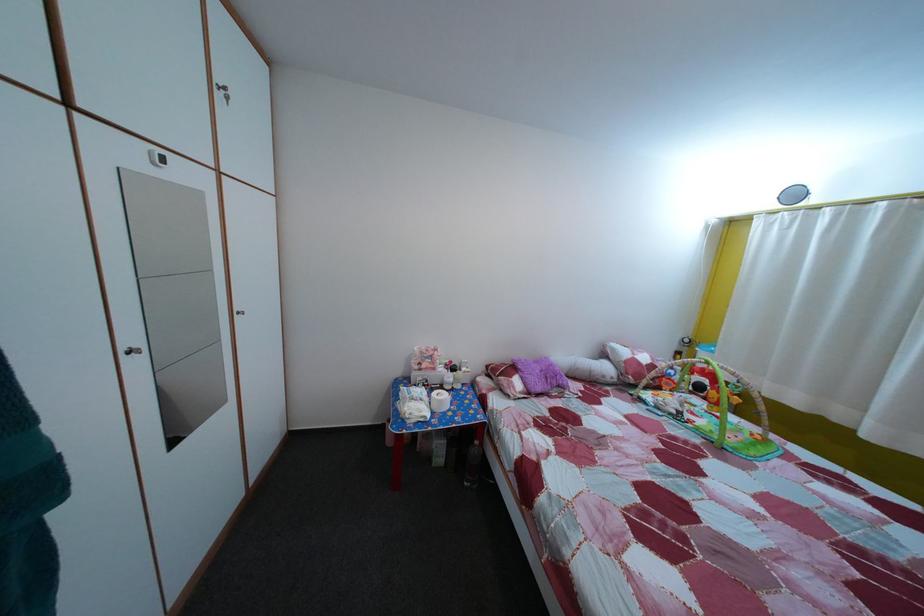
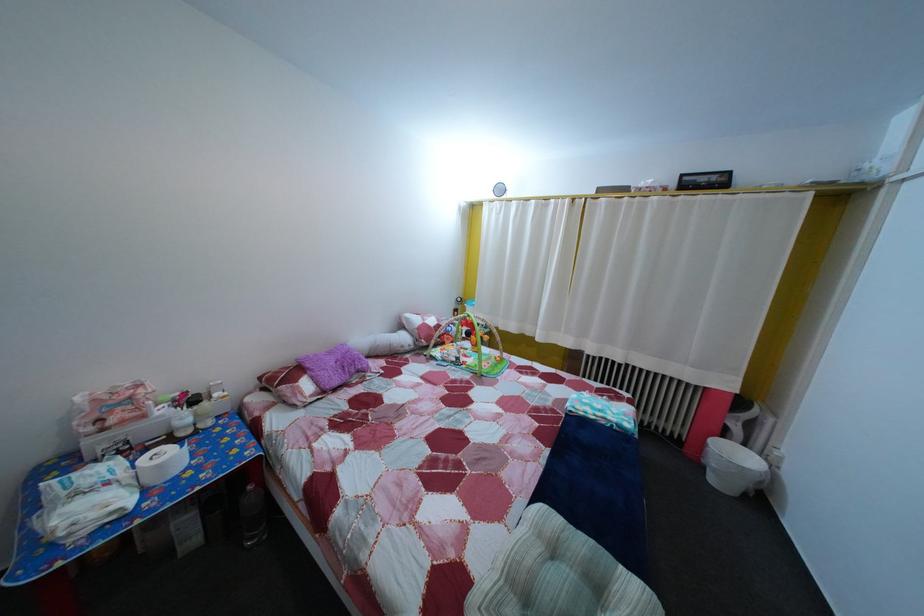
Question: The first image is from the beginning of the video and the second image is from the end. How did the camera likely rotate when shooting the video?

Choices:
 (A) Left
 (B) Right
 (C) Up
 (D) Down

Answer: (B)